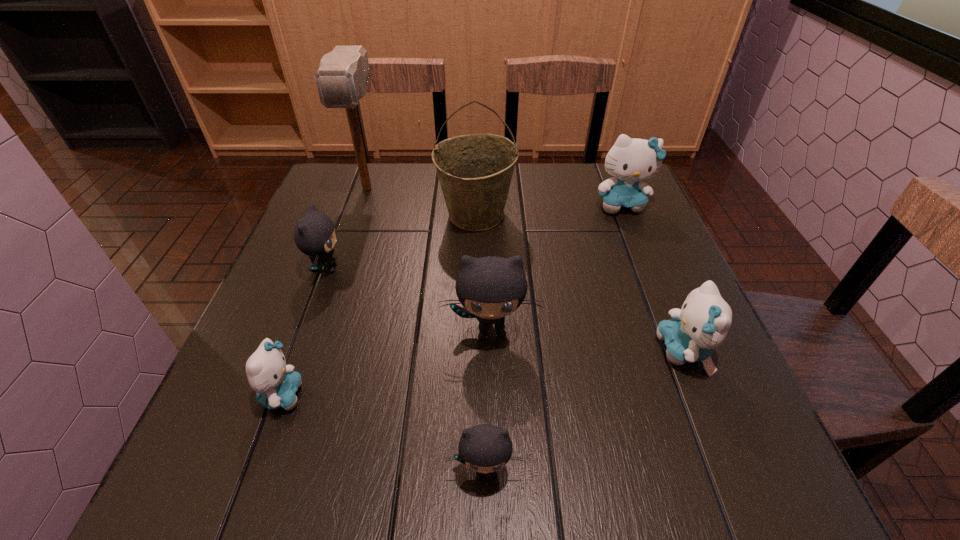
At what (x,y) coordinates should I click in order to perform the action: click on mallet positioned at the far edge. Please return your answer as a coordinate pair (x, y). Image resolution: width=960 pixels, height=540 pixels. Looking at the image, I should click on (342, 79).

Image resolution: width=960 pixels, height=540 pixels. Find the location of `wine bucket that is at the far edge`. wine bucket that is at the far edge is located at coordinates (475, 171).

Where is `kitten located at the far edge`? The image size is (960, 540). kitten located at the far edge is located at coordinates (630, 161).

This screenshot has width=960, height=540. I want to click on object that is at the near edge, so click(484, 448).

This screenshot has height=540, width=960. I want to click on mallet that is at the left edge, so click(342, 79).

This screenshot has height=540, width=960. I want to click on object that is positioned at the far left corner, so point(342,79).

Identify the location of object located in the far right corner section of the desktop. This screenshot has width=960, height=540. (630, 161).

Identify the location of free location at the far edge of the desktop. The width and height of the screenshot is (960, 540). (418, 210).

At what (x,y) coordinates should I click in order to perform the action: click on vacant space at the near edge. Please return your answer as a coordinate pair (x, y). The image size is (960, 540). Looking at the image, I should click on (362, 453).

The height and width of the screenshot is (540, 960). In the image, there is a desktop. In order to click on vacant space at the left edge in this screenshot , I will do `click(244, 414)`.